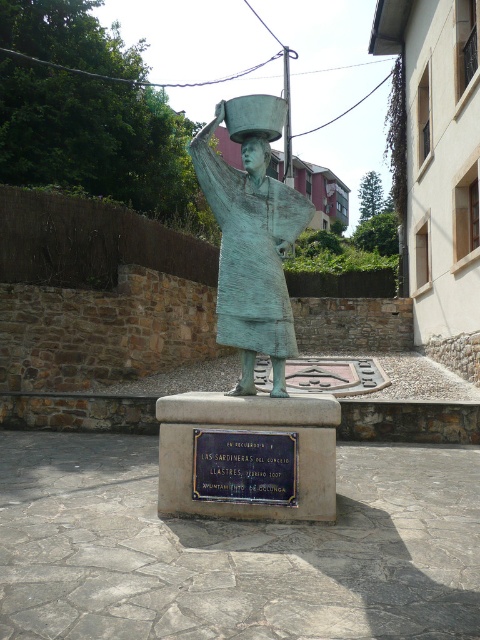
What is the spatial relationship between the green patina statue at center and the bronze plaque at center?

The green patina statue at center is located above the bronze plaque at center.

From the picture: You are an art student observing the statue and its base. You need to determine which object is taller between the green patina statue at center and the bronze plaque at center. Based on the scene, what can you conclude?

The green patina statue at center is much taller than the bronze plaque at center, so the statue is taller.

Looking at this image, what is the spatial relationship between the green patina statue at center and the bronze plaque at center?

The green patina statue at center is positioned on the right side of the bronze plaque at center.